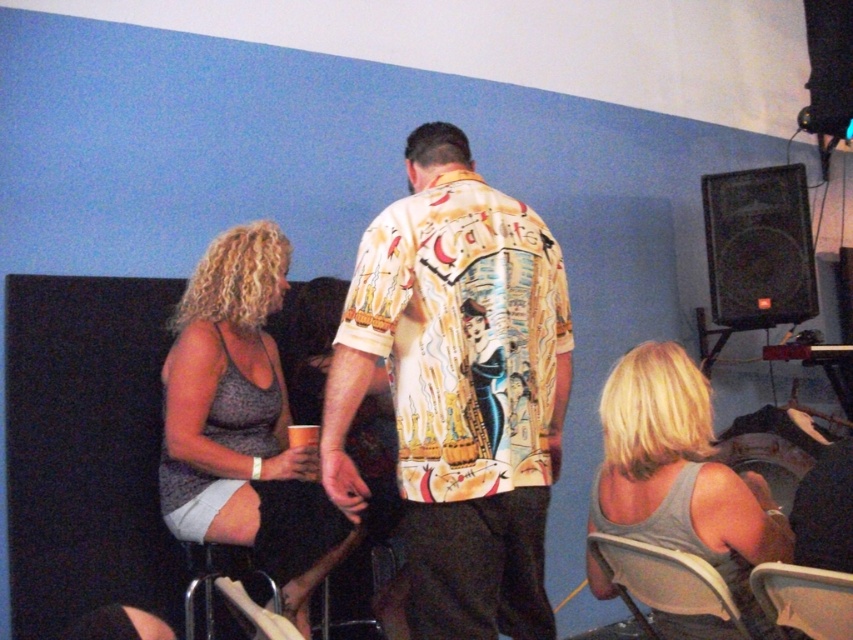
Question: Which point is closer to the camera?

Choices:
 (A) (849, 624)
 (B) (224, 552)
 (C) (757, 627)

Answer: (A)

Question: Based on their relative distances, which object is nearer to the white plastic chair at lower right?

Choices:
 (A) gray tank top at lower right
 (B) printed cotton shirt at center

Answer: (A)

Question: Among these points, which one is nearest to the camera?

Choices:
 (A) (456, 428)
 (B) (706, 458)

Answer: (A)

Question: In this image, where is printed cotton shirt at center located relative to gray tank top at lower right?

Choices:
 (A) right
 (B) left

Answer: (B)

Question: Does white fabric chair at lower right appear under metallic silver chair at lower left?

Choices:
 (A) no
 (B) yes

Answer: (A)

Question: Does gray tank top at lower right have a larger size compared to white fabric chair at lower right?

Choices:
 (A) no
 (B) yes

Answer: (B)